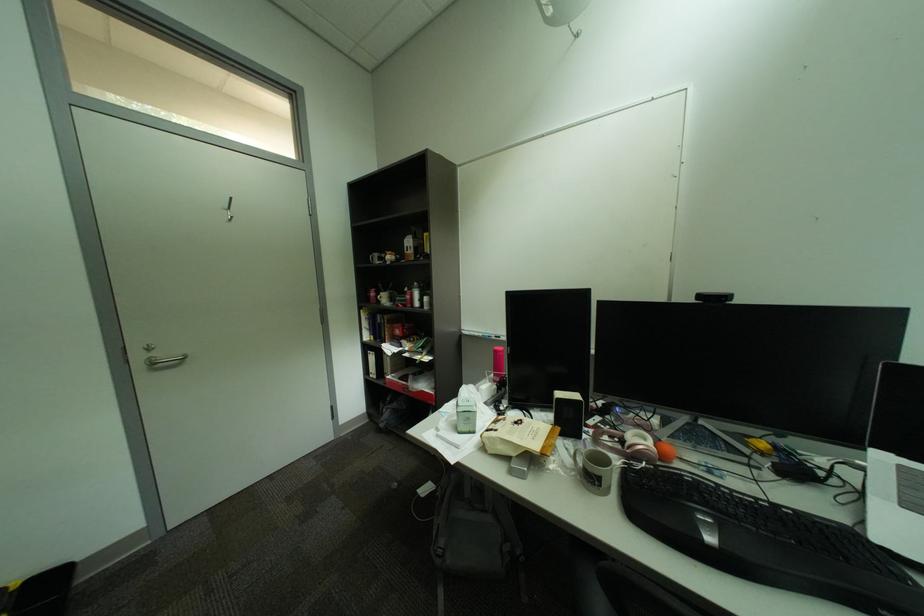
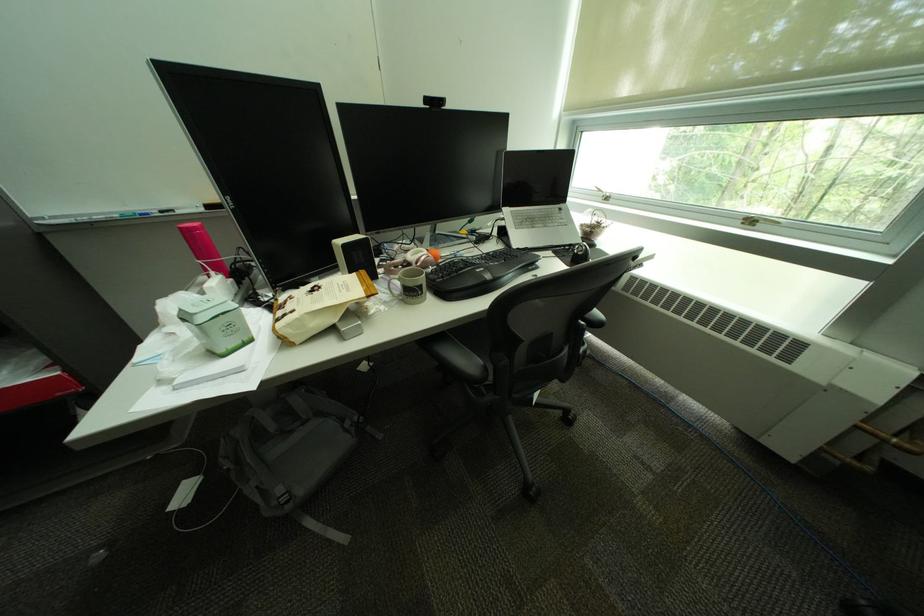
Where in the second image is the point corresponding to point (691, 474) from the first image?

(463, 261)